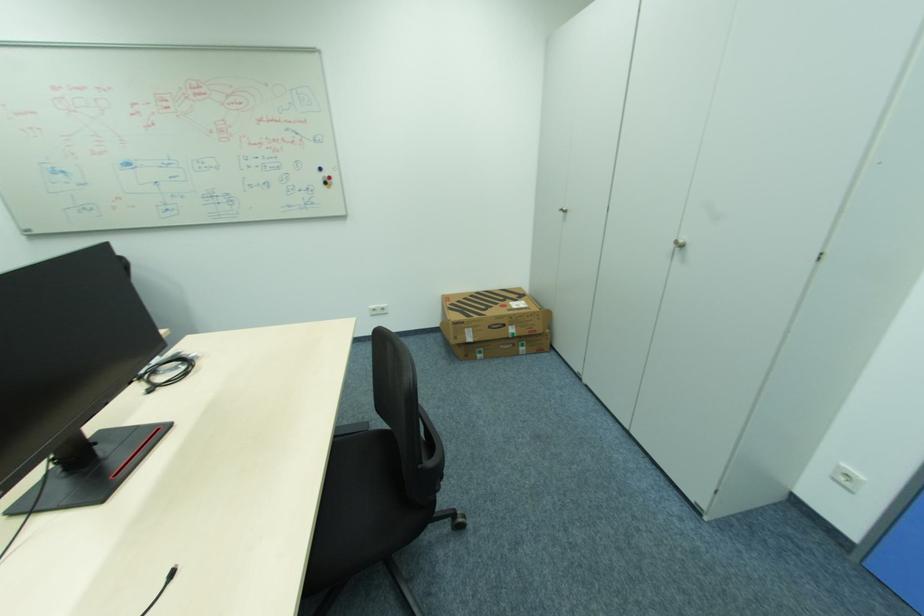
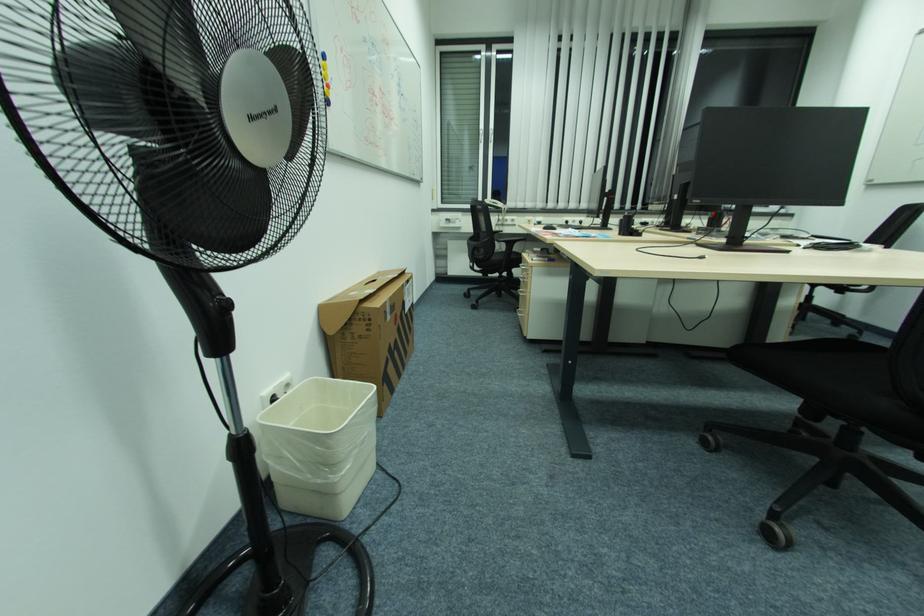
Looking at this image, first-person continuous shooting, in which direction is the camera rotating?

The camera's rotation is toward left-down.